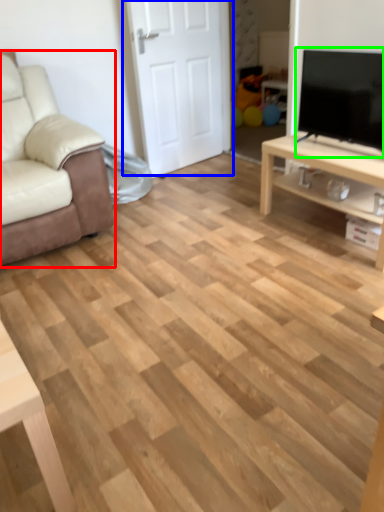
Question: Which object is positioned closest to chair (highlighted by a red box)? Select from door (highlighted by a blue box) and television (highlighted by a green box).

Choices:
 (A) door
 (B) television

Answer: (A)